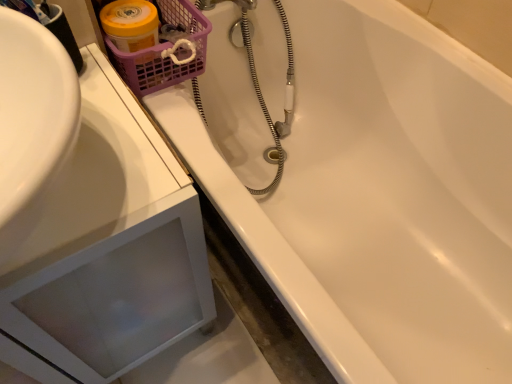
Question: Considering the positions of point (111, 49) and point (91, 261), is point (111, 49) closer or farther from the camera than point (91, 261)?

Choices:
 (A) closer
 (B) farther

Answer: (B)

Question: From the image's perspective, is purple plastic basket at upper left above or below white glossy sink at upper left?

Choices:
 (A) below
 (B) above

Answer: (B)

Question: In the image, is purple plastic basket at upper left on the left side or the right side of white glossy sink at upper left?

Choices:
 (A) left
 (B) right

Answer: (B)

Question: In terms of width, does white glossy sink at upper left look wider or thinner when compared to purple plastic basket at upper left?

Choices:
 (A) wide
 (B) thin

Answer: (A)

Question: From the image's perspective, is white glossy sink at upper left positioned above or below purple plastic basket at upper left?

Choices:
 (A) above
 (B) below

Answer: (B)

Question: Based on their sizes in the image, would you say white glossy sink at upper left is bigger or smaller than purple plastic basket at upper left?

Choices:
 (A) small
 (B) big

Answer: (B)

Question: Is white glossy sink at upper left in front of or behind purple plastic basket at upper left in the image?

Choices:
 (A) behind
 (B) front

Answer: (B)